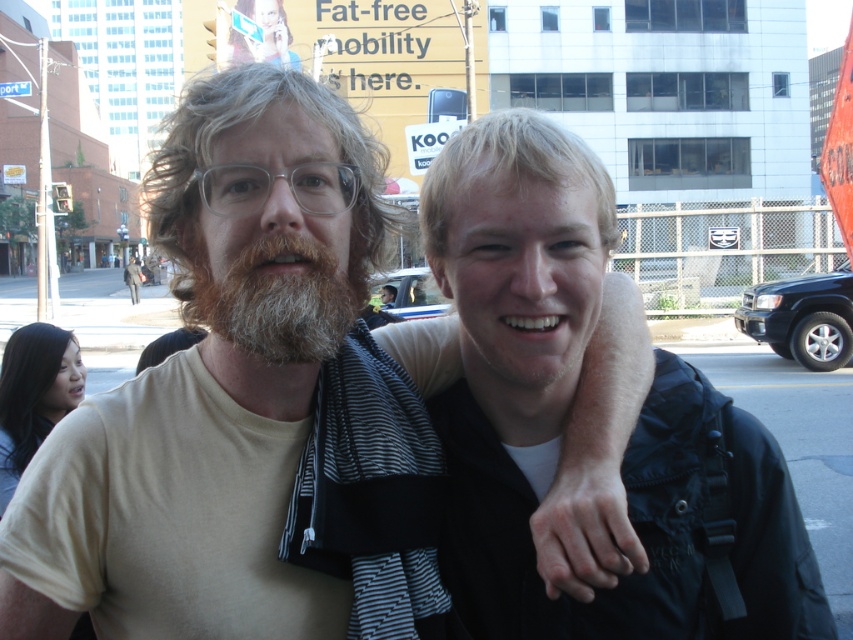
Can you confirm if light beige t-shirt at center is shorter than brown fuzzy beard at center?

In fact, light beige t-shirt at center may be taller than brown fuzzy beard at center.

This screenshot has height=640, width=853. Describe the element at coordinates (212, 388) in the screenshot. I see `light beige t-shirt at center` at that location.

Is point (201, 456) positioned in front of point (317, 336)?

No, (201, 456) is behind (317, 336).

You are a GUI agent. You are given a task and a screenshot of the screen. Output one action in this format:
    pyautogui.click(x=<x>, y=<y>)
    Task: Click on the light beige t-shirt at center
    
    Given the screenshot: What is the action you would take?
    pyautogui.click(x=212, y=388)

In the scene shown: Can you confirm if light beige t-shirt at center is positioned below black fabric backpack at center?

Actually, light beige t-shirt at center is above black fabric backpack at center.

Where is `light beige t-shirt at center`? This screenshot has width=853, height=640. light beige t-shirt at center is located at coordinates [212, 388].

This screenshot has height=640, width=853. I want to click on light beige t-shirt at center, so click(212, 388).

Where is `light beige t-shirt at center`? Image resolution: width=853 pixels, height=640 pixels. light beige t-shirt at center is located at coordinates (212, 388).

Is black fabric backpack at center above brown fuzzy beard at center?

Incorrect, black fabric backpack at center is not positioned above brown fuzzy beard at center.

Can you confirm if black fabric backpack at center is wider than brown fuzzy beard at center?

Correct, the width of black fabric backpack at center exceeds that of brown fuzzy beard at center.

Between point (465, 252) and point (276, 288), which one is positioned in front?

Point (276, 288) is in front.

Identify the location of black fabric backpack at center. The image size is (853, 640). (567, 406).